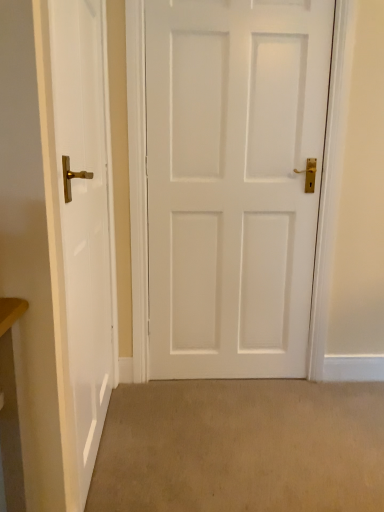
Locate an element on the screen. free spot to the right of white matte door at center, placed as the 1th door when sorted from right to left is located at coordinates [317, 401].